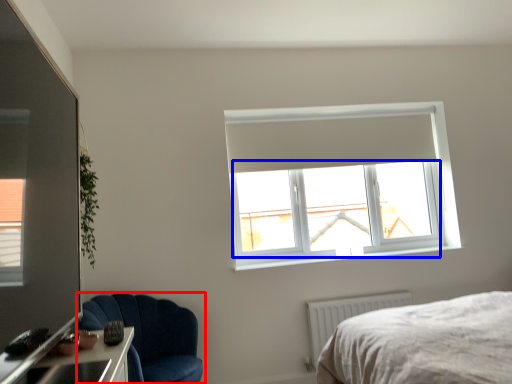
Question: Which point is closer to the camera, chair (highlighted by a red box) or window screen (highlighted by a blue box)?

Choices:
 (A) chair
 (B) window screen

Answer: (A)